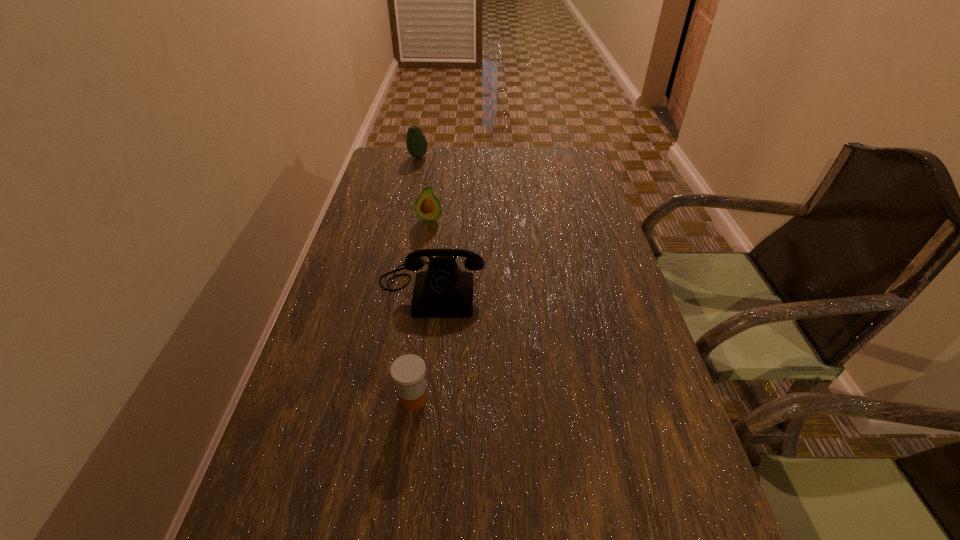
Find the location of `telephone present at the left edge`. telephone present at the left edge is located at coordinates (442, 291).

Find the location of a particular element. Image resolution: width=960 pixels, height=540 pixels. object at the far left corner is located at coordinates (416, 143).

Where is `vacant space at the far edge of the desktop`? vacant space at the far edge of the desktop is located at coordinates (492, 165).

Identify the location of free region at the left edge of the desktop. (357, 296).

This screenshot has width=960, height=540. What are the coordinates of `free space at the right edge of the desktop` in the screenshot? It's located at (585, 183).

Find the location of `vacant space at the far left corner of the desktop`. vacant space at the far left corner of the desktop is located at coordinates (393, 156).

Find the location of a particular element. free area in between the nearer avocado and the farthest object is located at coordinates (423, 187).

Locate an element on the screen. The height and width of the screenshot is (540, 960). object that stands as the closest to the farthest object is located at coordinates (427, 207).

At what (x,y) coordinates should I click in order to perform the action: click on object that ranks as the second closest to the telephone. Please return your answer as a coordinate pair (x, y). The width and height of the screenshot is (960, 540). Looking at the image, I should click on (408, 371).